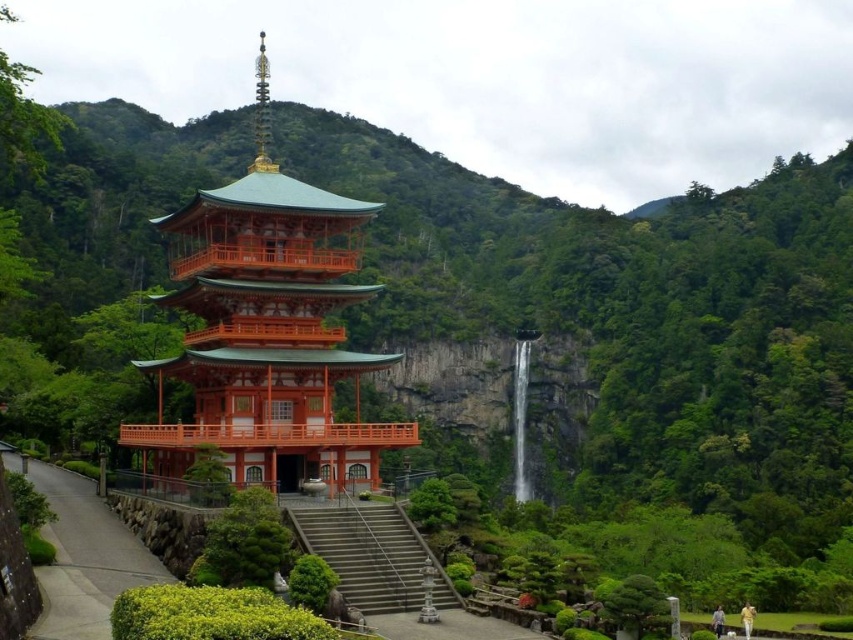
You are standing in front of the pagoda and want to determine the relative positions of two points marked in the scene. Which point is closer to you, point 1 at coordinates (x=99, y=502) or point 2 at coordinates (x=404, y=576)?

Point 1 at coordinates (x=99, y=502) is closer to you because it is further to the viewer than point 2 at coordinates (x=404, y=576).

You are standing at the center of the image. If you look towards the orange lacquered wood pagoda at center, which direction should you face?

Since the orange lacquered wood pagoda at center is located at point coordinates (265,330), you should face directly forward as it is centered in the image.

You are a tourist visiting this serene location and want to take a photo of the orange lacquered wood pagoda at center from the smooth concrete path at lower left. Based on their positions, can you stand on the path and still have the pagoda in your camera frame?

The orange lacquered wood pagoda at center is positioned on the left side of smooth concrete path at lower left, so yes, you can stand on the smooth concrete path at lower left and still have the orange lacquered wood pagoda at center in your camera frame since it is adjacent to the path.